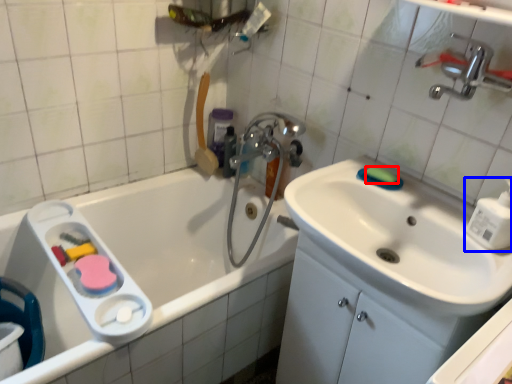
Question: Which point is further to the camera, soap (highlighted by a red box) or soap dispenser (highlighted by a blue box)?

Choices:
 (A) soap
 (B) soap dispenser

Answer: (A)